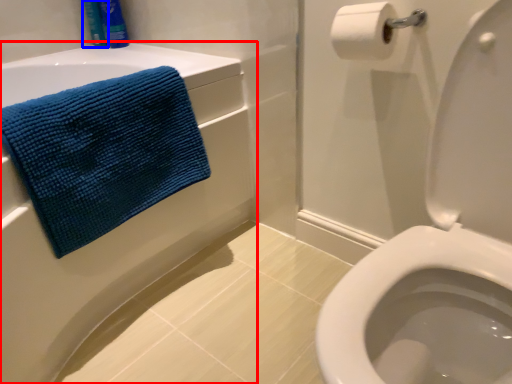
Question: Which of the following is the farthest to the observer, bath (highlighted by a red box) or toiletry (highlighted by a blue box)?

Choices:
 (A) bath
 (B) toiletry

Answer: (B)